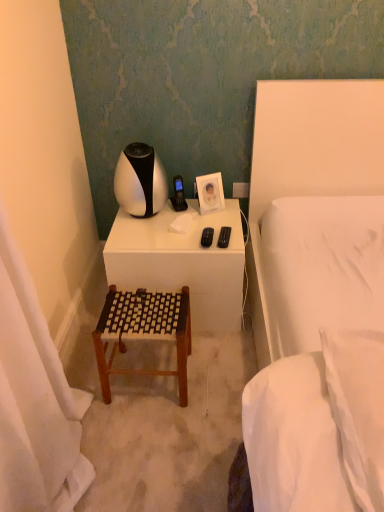
At what (x,y) coordinates should I click in order to perform the action: click on vacant region above white matte desk at center (from a real-world perspective). Please return your answer as a coordinate pair (x, y). This screenshot has height=512, width=384. Looking at the image, I should click on (176, 223).